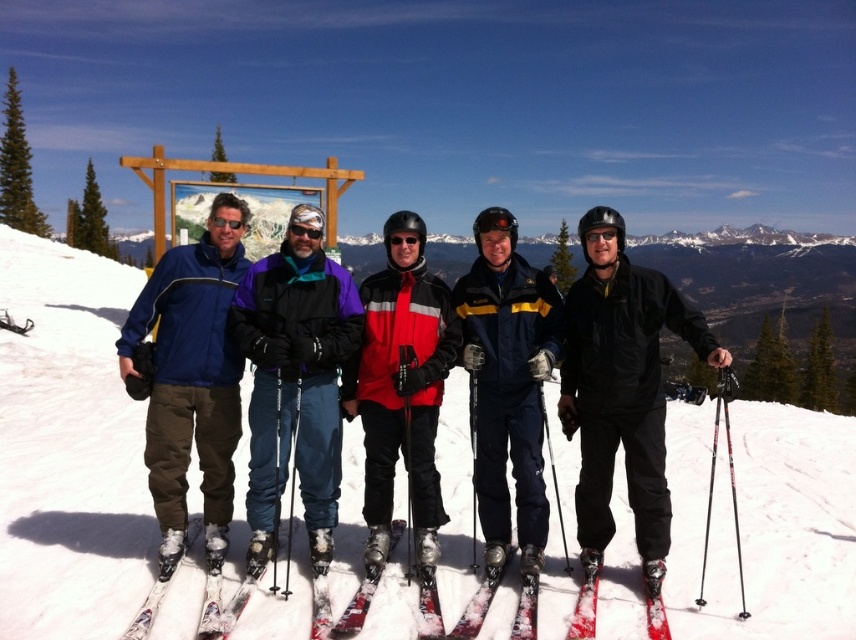
You are a photographer standing at the edge of a snowy slope. You want to capture a photo of the white powder snow at center and the metallic skis at center. If your camera has a maximum focus range of 10 meters, will you be able to clearly capture both subjects in focus without moving your position?

The white powder snow at center and metallic skis at center are 11.46 meters apart from each other. Since the camera can only focus up to 10 meters, it won not be able to capture both subjects in focus at the same time.

You are a photographer trying to capture a wide shot of the group. The metallic skis at center and the white matte ski at lower left are in the frame. Which ski should you adjust to ensure both fit within the camera frame without cropping?

The metallic skis at center are wider than the white matte ski at lower left, so you should adjust the metallic skis at center to ensure both fit within the camera frame without cropping.